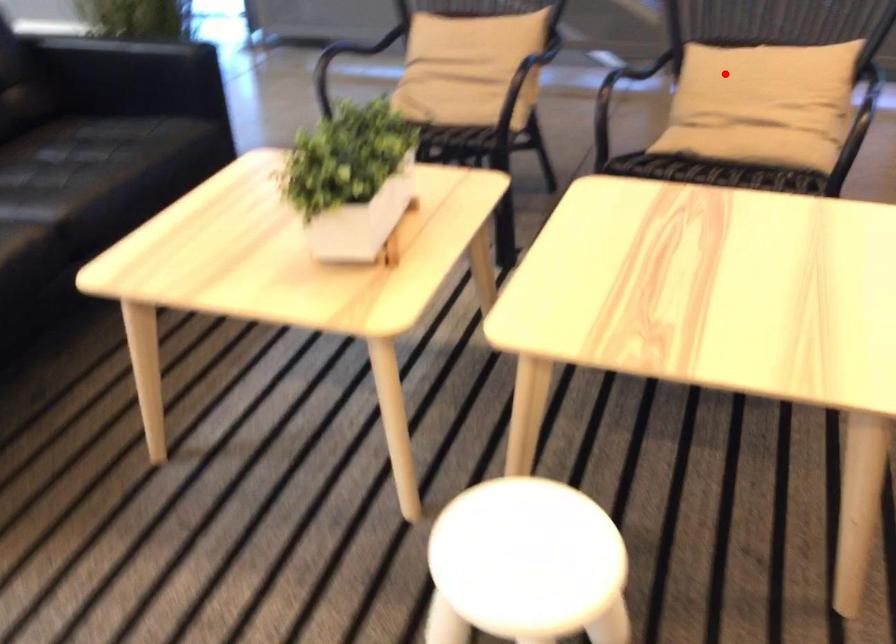
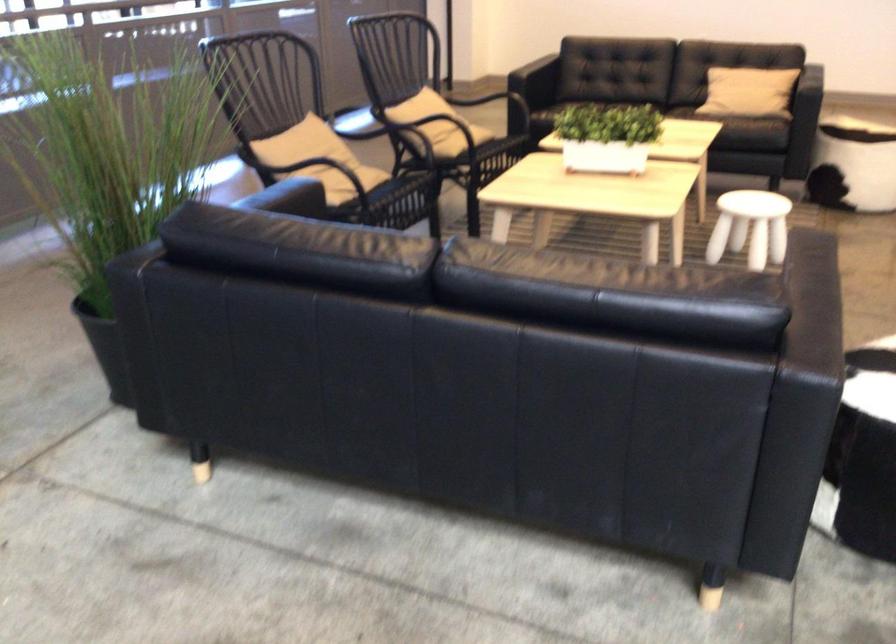
The point at the highlighted location is marked in the first image. Where is the corresponding point in the second image?

(431, 111)